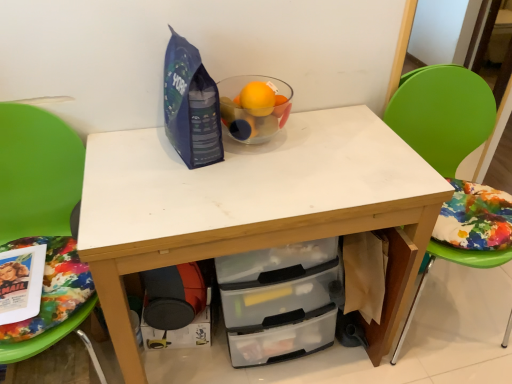
I want to click on black plastic drawer at lower center, so click(179, 333).

Measure the distance between transparent glass bowl at center and camera.

transparent glass bowl at center is 3.64 feet from camera.

Describe the element at coordinates (442, 114) in the screenshot. I see `green plastic chair at right, marked as the first chair in a right-to-left arrangement` at that location.

The height and width of the screenshot is (384, 512). Describe the element at coordinates (37, 172) in the screenshot. I see `green fabric chair at left, the first chair in the left-to-right sequence` at that location.

Identify the location of black plastic drawer at lower center. This screenshot has width=512, height=384. (179, 333).

Could transparent glass bowl at center be considered to be inside green plastic chair at right, the 2th chair from the left?

No, transparent glass bowl at center is not inside green plastic chair at right, the 2th chair from the left.

Which object is further away from the camera taking this photo, green plastic chair at right, the 2th chair from the left, or transparent glass bowl at center?

transparent glass bowl at center is further from the camera.

Considering the positions of point (413, 76) and point (256, 122), is point (413, 76) closer or farther from the camera than point (256, 122)?

Point (413, 76) is farther from the camera than point (256, 122).

Considering the relative positions of green plastic chair at right, marked as the first chair in a right-to-left arrangement, and transparent glass bowl at center in the image provided, is green plastic chair at right, marked as the first chair in a right-to-left arrangement, to the left or to the right of transparent glass bowl at center?

green plastic chair at right, marked as the first chair in a right-to-left arrangement, is positioned on transparent glass bowl at center's right side.

Is green fabric chair at left, the first chair in the left-to-right sequence, behind black plastic drawer at lower center?

No, the depth of green fabric chair at left, the first chair in the left-to-right sequence, is less than that of black plastic drawer at lower center.

From a real-world perspective, is green fabric chair at left, which is counted as the 2th chair, starting from the right, on top of black plastic drawer at lower center?

Yes.

Consider the image. Is green fabric chair at left, the first chair in the left-to-right sequence, not near black plastic drawer at lower center?

They are positioned close to each other.

Find the location of a particular element. This screenshot has width=512, height=384. the 1st chair above the black plastic drawer at lower center (from the image's perspective) is located at coordinates (37, 172).

Is green fabric chair at left, the first chair in the left-to-right sequence, with white matte table at center?

green fabric chair at left, the first chair in the left-to-right sequence, is not next to white matte table at center, and they're not touching.

Is green fabric chair at left, which is counted as the 2th chair, starting from the right, bigger or smaller than white matte table at center?

In the image, green fabric chair at left, which is counted as the 2th chair, starting from the right, appears to be smaller than white matte table at center.

From the image's perspective, is green fabric chair at left, the first chair in the left-to-right sequence, positioned above or below white matte table at center?

green fabric chair at left, the first chair in the left-to-right sequence, is below white matte table at center.

Who is taller, green fabric chair at left, the first chair in the left-to-right sequence, or white matte table at center?

green fabric chair at left, the first chair in the left-to-right sequence.

Which is correct: green plastic chair at right, the 2th chair from the left, is inside green fabric chair at left, the first chair in the left-to-right sequence, or outside of it?

The correct answer is: outside.

Are green plastic chair at right, marked as the first chair in a right-to-left arrangement, and green fabric chair at left, the first chair in the left-to-right sequence, located far from each other?

green plastic chair at right, marked as the first chair in a right-to-left arrangement, is positioned a significant distance from green fabric chair at left, the first chair in the left-to-right sequence.

Which object is closer to the camera taking this photo, green plastic chair at right, marked as the first chair in a right-to-left arrangement, or green fabric chair at left, which is counted as the 2th chair, starting from the right?

green fabric chair at left, which is counted as the 2th chair, starting from the right, is closer to the camera.

Considering the relative sizes of green plastic chair at right, marked as the first chair in a right-to-left arrangement, and green fabric chair at left, the first chair in the left-to-right sequence, in the image provided, is green plastic chair at right, marked as the first chair in a right-to-left arrangement, shorter than green fabric chair at left, the first chair in the left-to-right sequence,?

Incorrect, the height of green plastic chair at right, marked as the first chair in a right-to-left arrangement, does not fall short of that of green fabric chair at left, the first chair in the left-to-right sequence.

Who is smaller, transparent glass bowl at center or green fabric chair at left, the first chair in the left-to-right sequence?

With smaller size is transparent glass bowl at center.

Is transparent glass bowl at center turned away from green fabric chair at left, the first chair in the left-to-right sequence?

No, transparent glass bowl at center's orientation is not away from green fabric chair at left, the first chair in the left-to-right sequence.

Consider the image. Is the surface of transparent glass bowl at center in direct contact with green fabric chair at left, the first chair in the left-to-right sequence?

No, transparent glass bowl at center is not next to green fabric chair at left, the first chair in the left-to-right sequence.

Considering the relative positions of transparent glass bowl at center and green fabric chair at left, which is counted as the 2th chair, starting from the right, in the image provided, is transparent glass bowl at center behind green fabric chair at left, which is counted as the 2th chair, starting from the right,?

Yes, it is behind green fabric chair at left, which is counted as the 2th chair, starting from the right.

Where is `chair that appears above the white matte table at center (from the image's perspective)`? The image size is (512, 384). chair that appears above the white matte table at center (from the image's perspective) is located at coordinates click(x=442, y=114).

Which point is more forward, (133, 379) or (426, 128)?

The point (133, 379) is closer to the camera.

In the scene shown: Does white matte table at center have a lesser width compared to green plastic chair at right, the 2th chair from the left?

Yes.

Is transparent glass bowl at center smaller than white matte table at center?

Yes, transparent glass bowl at center is smaller than white matte table at center.

In the image, is transparent glass bowl at center positioned in front of or behind white matte table at center?

transparent glass bowl at center is behind white matte table at center.

Does transparent glass bowl at center have a greater height compared to white matte table at center?

In fact, transparent glass bowl at center may be shorter than white matte table at center.

Is transparent glass bowl at center wider than white matte table at center?

No.

This screenshot has width=512, height=384. What are the coordinates of `bowl above the green plastic chair at right, marked as the first chair in a right-to-left arrangement (from the image's perspective)` in the screenshot? It's located at (254, 106).

Image resolution: width=512 pixels, height=384 pixels. Identify the location of drawer that appears on the right of green fabric chair at left, which is counted as the 2th chair, starting from the right. (179, 333).

Which object lies further to the anchor point green fabric chair at left, the first chair in the left-to-right sequence, white matte table at center or black plastic drawer at lower center?

black plastic drawer at lower center.

Which object lies further to the anchor point green fabric chair at left, which is counted as the 2th chair, starting from the right, green plastic chair at right, marked as the first chair in a right-to-left arrangement, or white matte table at center?

The object further to green fabric chair at left, which is counted as the 2th chair, starting from the right, is green plastic chair at right, marked as the first chair in a right-to-left arrangement.

Considering their positions, is transparent glass bowl at center positioned closer to green plastic chair at right, marked as the first chair in a right-to-left arrangement, than white matte table at center?

Among the two, white matte table at center is located nearer to green plastic chair at right, marked as the first chair in a right-to-left arrangement.

Estimate the real-world distances between objects in this image. Which object is further from black plastic drawer at lower center, white matte table at center or green plastic chair at right, the 2th chair from the left?

Among the two, green plastic chair at right, the 2th chair from the left, is located further to black plastic drawer at lower center.

Estimate the real-world distances between objects in this image. Which object is further from black plastic drawer at lower center, green plastic chair at right, the 2th chair from the left, or green fabric chair at left, the first chair in the left-to-right sequence?

green plastic chair at right, the 2th chair from the left, is further to black plastic drawer at lower center.

Based on their spatial positions, is white matte table at center or green fabric chair at left, the first chair in the left-to-right sequence, further from transparent glass bowl at center?

green fabric chair at left, the first chair in the left-to-right sequence, lies further to transparent glass bowl at center than the other object.

Looking at the image, which one is located closer to transparent glass bowl at center, green plastic chair at right, the 2th chair from the left, or green fabric chair at left, the first chair in the left-to-right sequence?

green fabric chair at left, the first chair in the left-to-right sequence.

Based on their spatial positions, is transparent glass bowl at center or white matte table at center closer to black plastic drawer at lower center?

Based on the image, white matte table at center appears to be nearer to black plastic drawer at lower center.

I want to click on bowl located between black plastic drawer at lower center and green plastic chair at right, marked as the first chair in a right-to-left arrangement, in the left-right direction, so click(x=254, y=106).

Where is `table between transparent glass bowl at center and green plastic chair at right, the 2th chair from the left`? table between transparent glass bowl at center and green plastic chair at right, the 2th chair from the left is located at coordinates (252, 206).

Image resolution: width=512 pixels, height=384 pixels. What are the coordinates of `bowl between green fabric chair at left, the first chair in the left-to-right sequence, and white matte table at center from left to right` in the screenshot? It's located at coord(254,106).

Where is `drawer located between green fabric chair at left, which is counted as the 2th chair, starting from the right, and green plastic chair at right, marked as the first chair in a right-to-left arrangement, in the left-right direction`? This screenshot has width=512, height=384. drawer located between green fabric chair at left, which is counted as the 2th chair, starting from the right, and green plastic chair at right, marked as the first chair in a right-to-left arrangement, in the left-right direction is located at coordinates (179, 333).